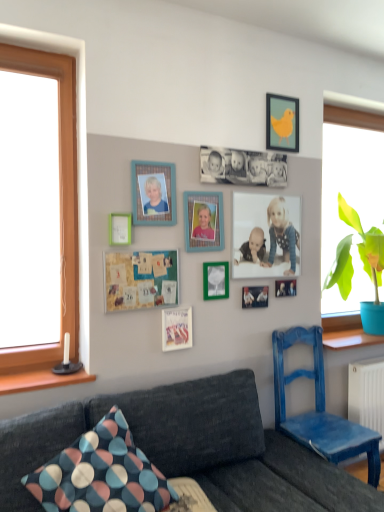
Question: Is green matte picture frame at upper left, arranged as the fifth picture frame when viewed from the top, in front of wooden photo frame at center, positioned as the fourth picture frame in top-to-bottom order?

Choices:
 (A) no
 (B) yes

Answer: (B)

Question: Is green matte picture frame at upper left, positioned as the sixth picture frame in bottom-to-top order, facing towards wooden photo frame at center, the seventh picture frame from the bottom?

Choices:
 (A) no
 (B) yes

Answer: (A)

Question: Considering the relative sizes of green matte picture frame at upper left, positioned as the sixth picture frame in bottom-to-top order, and wooden photo frame at center, the seventh picture frame from the bottom, in the image provided, is green matte picture frame at upper left, positioned as the sixth picture frame in bottom-to-top order, taller than wooden photo frame at center, the seventh picture frame from the bottom,?

Choices:
 (A) yes
 (B) no

Answer: (B)

Question: From a real-world perspective, does green matte picture frame at upper left, arranged as the fifth picture frame when viewed from the top, sit lower than wooden photo frame at center, the seventh picture frame from the bottom?

Choices:
 (A) yes
 (B) no

Answer: (A)

Question: Is green matte picture frame at upper left, positioned as the sixth picture frame in bottom-to-top order, not near wooden photo frame at center, the seventh picture frame from the bottom?

Choices:
 (A) no
 (B) yes

Answer: (A)

Question: Is wooden photo frame at center, the seventh picture frame from the bottom, a part of green matte picture frame at upper left, arranged as the fifth picture frame when viewed from the top?

Choices:
 (A) yes
 (B) no

Answer: (B)

Question: Can you confirm if green matte picture frame at upper left, arranged as the fifth picture frame when viewed from the top, is wider than metallic silver photo frame at center, which ranks as the 3th picture frame in bottom-to-top order?

Choices:
 (A) yes
 (B) no

Answer: (A)

Question: Is green matte picture frame at upper left, positioned as the sixth picture frame in bottom-to-top order, turned away from metallic silver photo frame at center, which ranks as the 3th picture frame in bottom-to-top order?

Choices:
 (A) yes
 (B) no

Answer: (B)

Question: Is green matte picture frame at upper left, arranged as the fifth picture frame when viewed from the top, oriented towards metallic silver photo frame at center, which ranks as the 3th picture frame in bottom-to-top order?

Choices:
 (A) yes
 (B) no

Answer: (B)

Question: Can you confirm if green matte picture frame at upper left, arranged as the fifth picture frame when viewed from the top, is thinner than metallic silver photo frame at center, which is the 8th picture frame from top to bottom?

Choices:
 (A) no
 (B) yes

Answer: (A)

Question: Does green matte picture frame at upper left, positioned as the sixth picture frame in bottom-to-top order, lie in front of metallic silver photo frame at center, which is the 8th picture frame from top to bottom?

Choices:
 (A) yes
 (B) no

Answer: (A)

Question: Does green matte picture frame at upper left, positioned as the sixth picture frame in bottom-to-top order, appear on the right side of metallic silver photo frame at center, which ranks as the 3th picture frame in bottom-to-top order?

Choices:
 (A) no
 (B) yes

Answer: (A)

Question: From the image's perspective, is green matte picture frame at center, which appears as the seventh picture frame when viewed from the top, located beneath matte plastic picture frame at center, which is counted as the first picture frame, starting from the bottom?

Choices:
 (A) no
 (B) yes

Answer: (A)